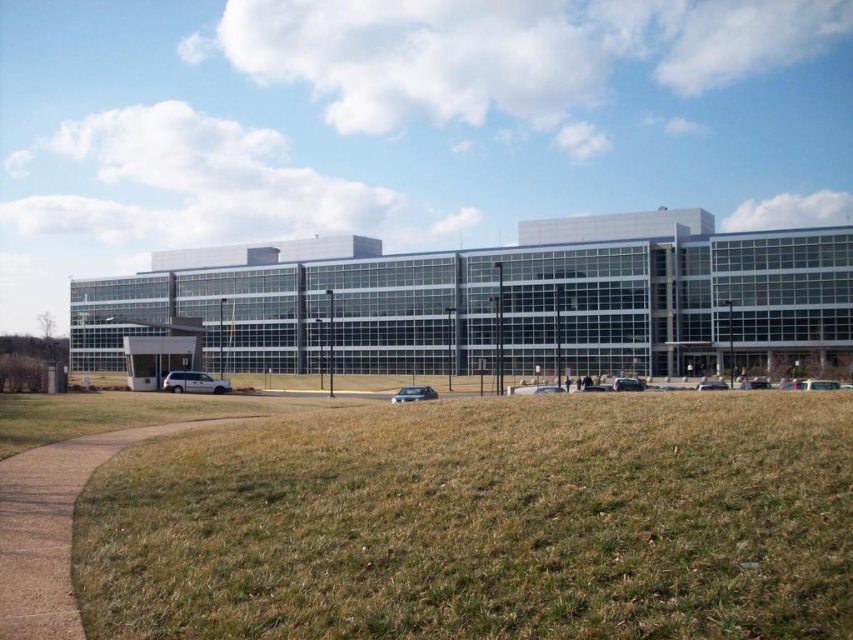
Measure the distance between white matte van at center and camera.

They are 50.60 meters apart.

Between point (210, 388) and point (410, 394), which one is positioned in front?

Point (410, 394) is more forward.

Who is more forward, [173,380] or [426,387]?

Point [173,380] is in front.

This screenshot has height=640, width=853. I want to click on white matte van at center, so click(x=193, y=381).

Is transparent glass building at center bigger than satin silver sedan at center?

Yes.

Is transparent glass building at center further to the viewer compared to satin silver sedan at center?

Yes, it is behind satin silver sedan at center.

Does point (614, 344) come closer to viewer compared to point (398, 392)?

No, (614, 344) is further to viewer.

Identify the location of transparent glass building at center. (492, 301).

Is brown dry grass at lower left closer to the viewer compared to satin silver sedan at center?

Yes, it is in front of satin silver sedan at center.

Can you confirm if brown dry grass at lower left is wider than satin silver sedan at center?

Incorrect, brown dry grass at lower left's width does not surpass satin silver sedan at center's.

Between point (686, 579) and point (418, 387), which one is positioned in front?

Point (686, 579) is in front.

Where is `brown dry grass at lower left`? The image size is (853, 640). brown dry grass at lower left is located at coordinates (482, 524).